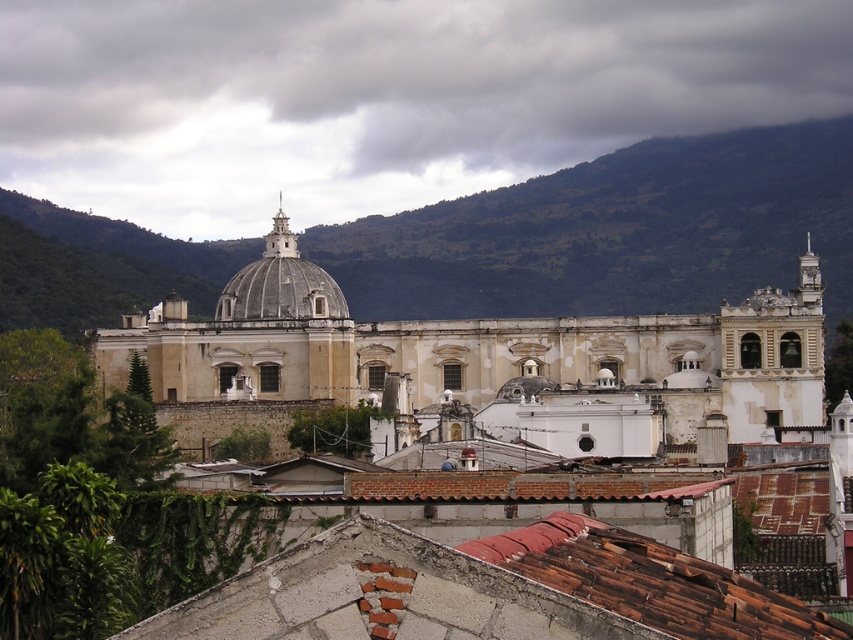
Question: Which object is positioned closest to the white stone church at center?

Choices:
 (A) smooth gray dome at center
 (B) brown tile roof at center
 (C) green leafy mountain at upper center

Answer: (A)

Question: Where is white stone church at center located in relation to smooth gray dome at center in the image?

Choices:
 (A) right
 (B) left

Answer: (A)

Question: Which point appears closest to the camera in this image?

Choices:
 (A) [508, 556]
 (B) [181, 326]

Answer: (A)

Question: Is green leafy mountain at upper center thinner than smooth gray dome at center?

Choices:
 (A) yes
 (B) no

Answer: (B)

Question: Among these points, which one is farthest from the camera?

Choices:
 (A) [695, 394]
 (B) [491, 627]
 (C) [704, 304]
 (D) [317, 284]

Answer: (C)

Question: Where is green leafy mountain at upper center located in relation to smooth gray dome at center in the image?

Choices:
 (A) right
 (B) left

Answer: (A)